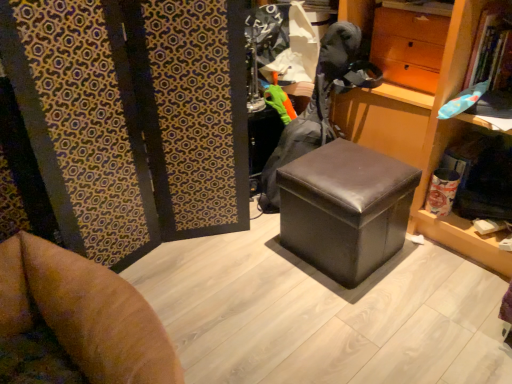
Question: From their relative heights in the image, would you say black leather ottoman at center is taller or shorter than matte brown drawer at upper right?

Choices:
 (A) tall
 (B) short

Answer: (A)

Question: From the image's perspective, relative to matte brown drawer at upper right, is black leather ottoman at center above or below?

Choices:
 (A) below
 (B) above

Answer: (A)

Question: Which object is positioned closest to the matte brown drawer at upper right?

Choices:
 (A) green fabric glove at center
 (B) black leather ottoman at center
 (C) wooden bookshelf at center

Answer: (C)

Question: Which of these objects is positioned closest to the green fabric glove at center?

Choices:
 (A) wooden bookshelf at center
 (B) black leather ottoman at center
 (C) matte brown drawer at upper right

Answer: (C)